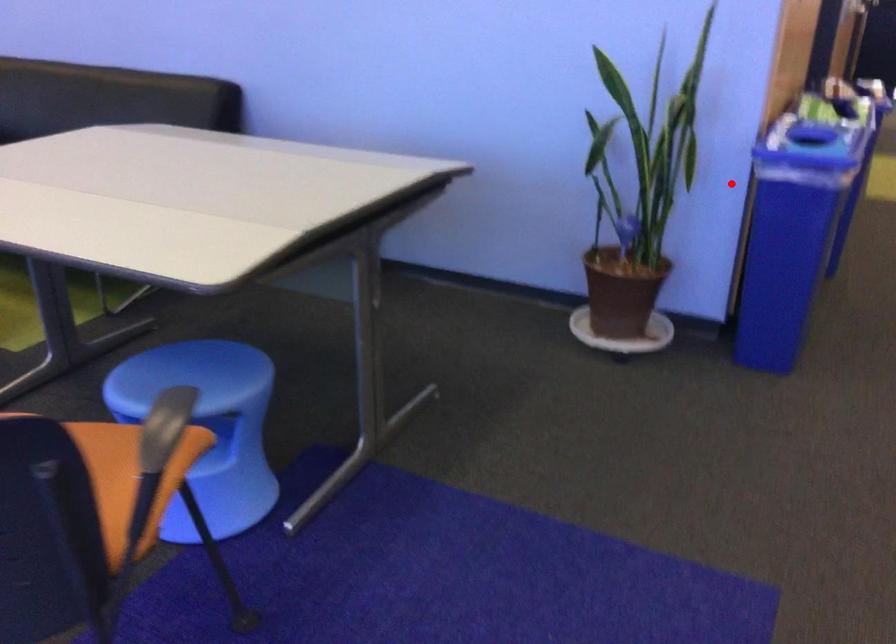
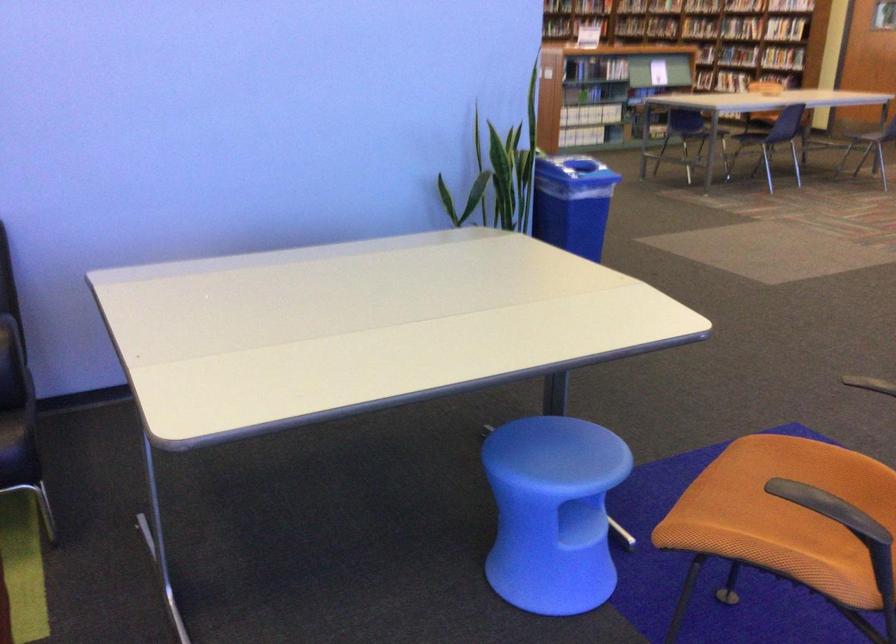
Question: I am providing you with two images of the same scene from different viewpoints. Given a red point in image1, look at the same physical point in image2. Is it:

Choices:
 (A) Closer to the viewpoint
 (B) Farther from the viewpoint

Answer: (B)